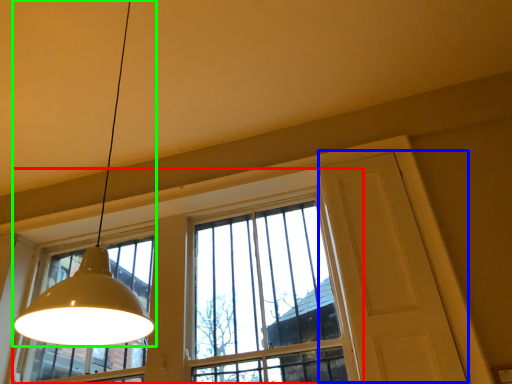
Question: Based on their relative distances, which object is farther from window (highlighted by a red box)? Choose from screen door (highlighted by a blue box) and lamp (highlighted by a green box).

Choices:
 (A) screen door
 (B) lamp

Answer: (B)